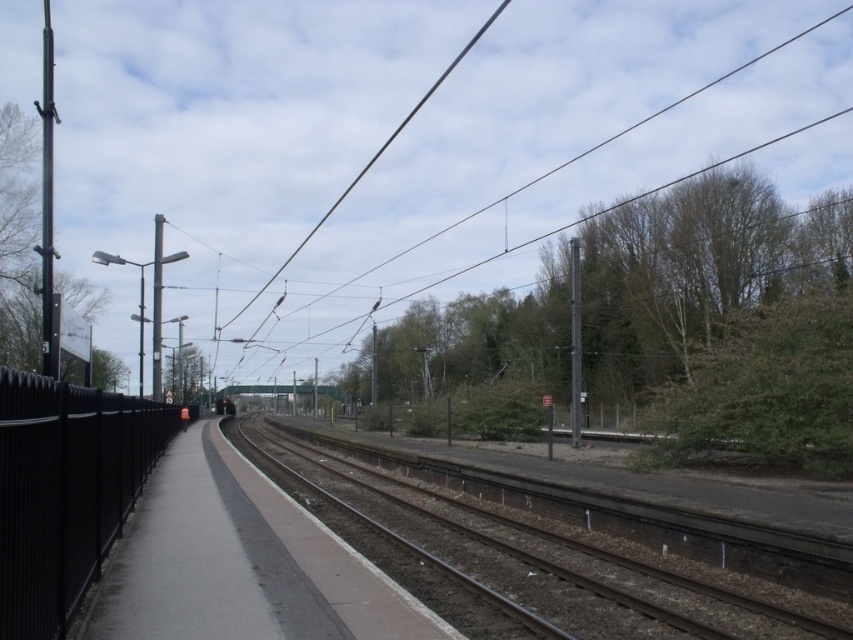
Question: Which point appears farthest from the camera in this image?

Choices:
 (A) (534, 528)
 (B) (366, 637)
 (C) (463, 48)

Answer: (C)

Question: Does brown gravel track at center have a lesser width compared to concrete platform at center?

Choices:
 (A) no
 (B) yes

Answer: (A)

Question: Which point appears closest to the camera in this image?

Choices:
 (A) (251, 300)
 (B) (154, 426)
 (C) (407, 502)

Answer: (B)

Question: Which of the following is the closest to the observer?

Choices:
 (A) (357, 616)
 (B) (84, 577)

Answer: (A)

Question: Is black metal fence at left above black wire at upper center?

Choices:
 (A) yes
 (B) no

Answer: (B)

Question: Is brown gravel track at center closer to the viewer compared to black metal fence at left?

Choices:
 (A) no
 (B) yes

Answer: (A)